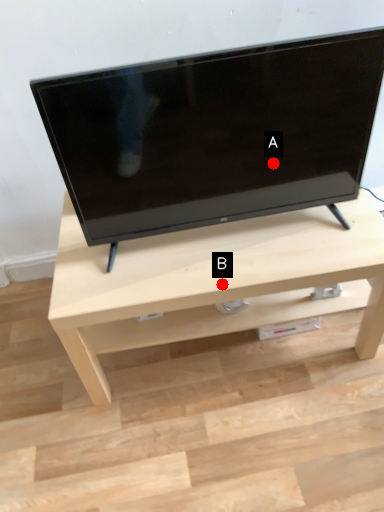
Question: Two points are circled on the image, labeled by A and B beside each circle. Which point is farther to the camera?

Choices:
 (A) A is further
 (B) B is further

Answer: (B)